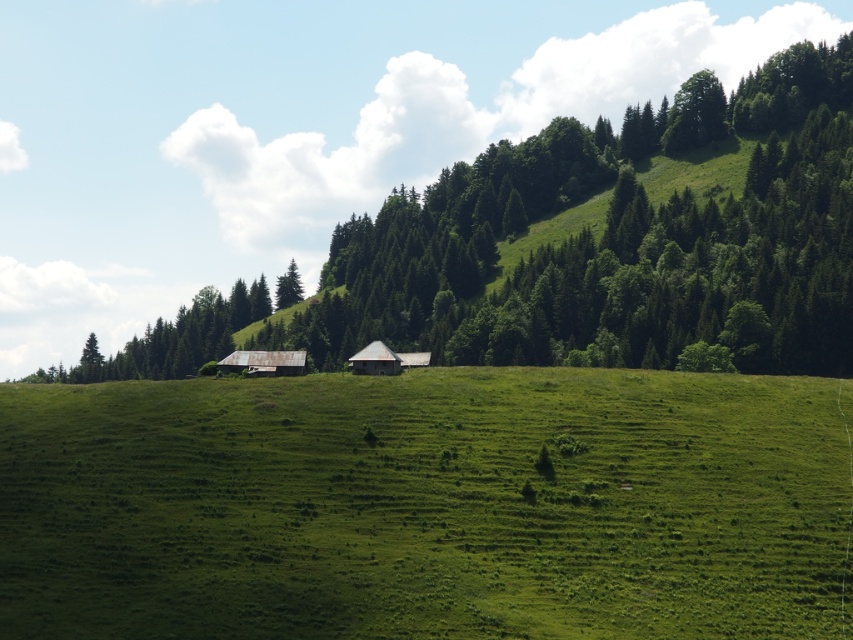
Is green grassy field at center positioned at the back of green leafy trees at center?

No, it is not.

Is green grassy field at center bigger than green leafy trees at center?

No, green grassy field at center is not bigger than green leafy trees at center.

Measure the distance between point (x=437, y=493) and camera.

They are 243.47 feet apart.

Identify the location of green grassy field at center. The image size is (853, 640). (422, 506).

The width and height of the screenshot is (853, 640). What do you see at coordinates (172, 339) in the screenshot?
I see `green matte tree at center` at bounding box center [172, 339].

Can you confirm if green matte tree at center is thinner than rusty metal barn at center?

No, green matte tree at center is not thinner than rusty metal barn at center.

Locate an element on the screen. The width and height of the screenshot is (853, 640). green matte tree at center is located at coordinates point(172,339).

Based on the photo, between green leafy trees at center and rusty metal barn at center, which one appears on the left side from the viewer's perspective?

rusty metal barn at center is more to the left.

Does point (788, 278) come closer to viewer compared to point (230, 362)?

No, (788, 278) is behind (230, 362).

I want to click on green leafy trees at center, so click(x=616, y=237).